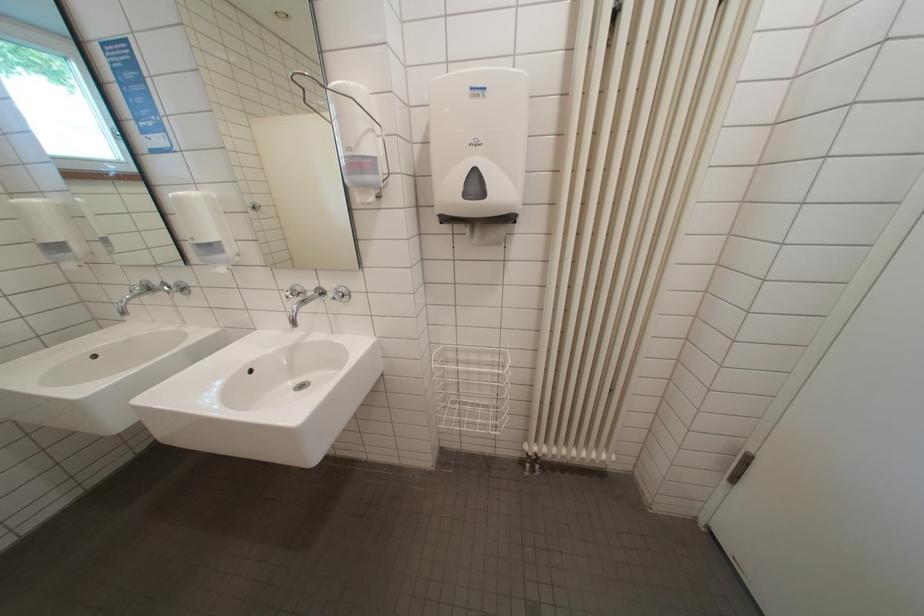
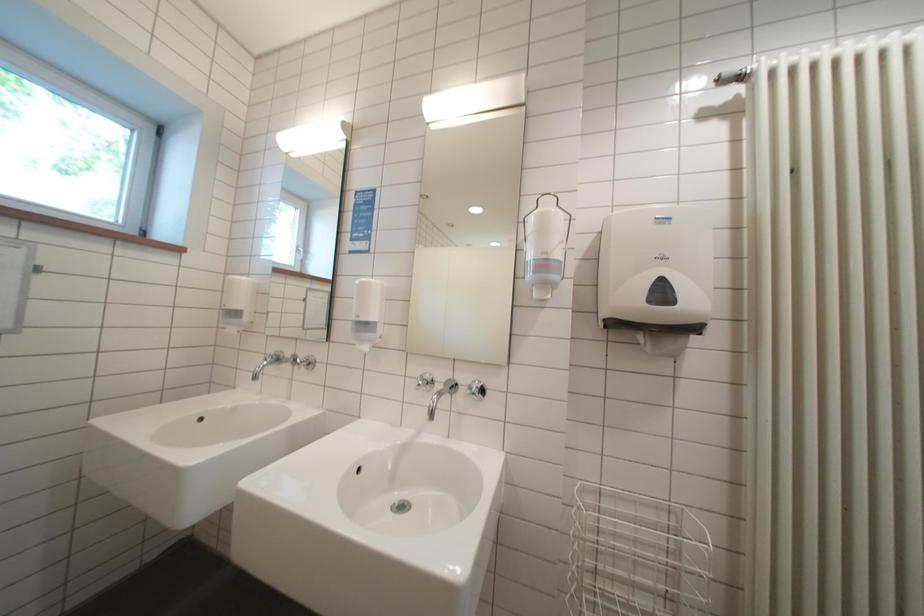
Question: How did the camera likely rotate?

Choices:
 (A) Left
 (B) Right
 (C) Up
 (D) Down

Answer: (C)